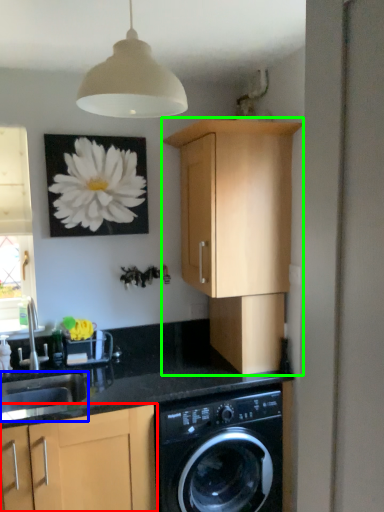
Question: Which object is the closest to the cabinetry (highlighted by a red box)? Choose among these: sink (highlighted by a blue box) or cabinetry (highlighted by a green box).

Choices:
 (A) sink
 (B) cabinetry

Answer: (A)